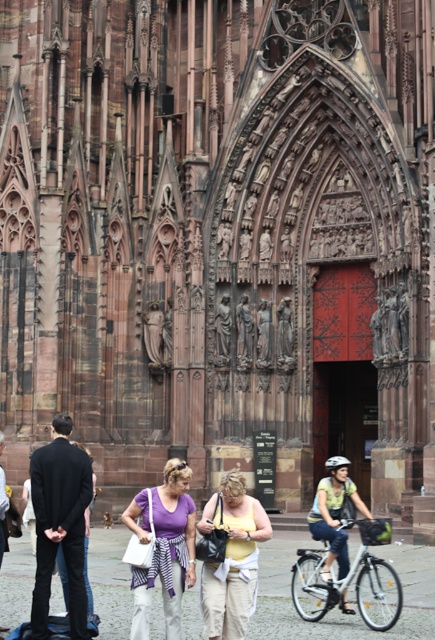
This screenshot has width=435, height=640. What do you see at coordinates (60, 524) in the screenshot? I see `black matte suit at left` at bounding box center [60, 524].

I want to click on black matte suit at left, so click(x=60, y=524).

The width and height of the screenshot is (435, 640). Describe the element at coordinates (60, 524) in the screenshot. I see `black matte suit at left` at that location.

Where is `black matte suit at left`? This screenshot has width=435, height=640. black matte suit at left is located at coordinates [x=60, y=524].

Which is above, denim jeans at lower right or dark gray jacket at lower left?

dark gray jacket at lower left is higher up.

Is point (325, 529) positioned after point (3, 472)?

No.

Which is behind, point (348, 483) or point (0, 637)?

The point (348, 483) is more distant.

Where is `denim jeans at lower right`? This screenshot has width=435, height=640. denim jeans at lower right is located at coordinates (334, 513).

Who is more distant from viewer, [56,509] or [207,632]?

Positioned behind is point [56,509].

Describe the element at coordinates (60, 524) in the screenshot. I see `black matte suit at left` at that location.

Is point (36, 573) closer to viewer compared to point (243, 586)?

That is False.

Locate an element on the screen. black matte suit at left is located at coordinates (60, 524).